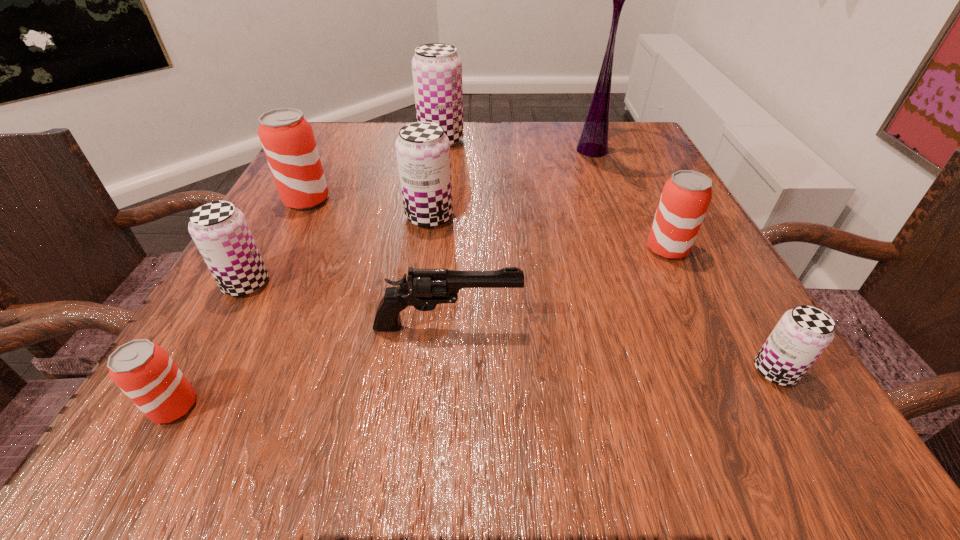
The height and width of the screenshot is (540, 960). In order to click on lampshade in this screenshot , I will do `click(593, 142)`.

Identify the location of the second tallest object. (436, 68).

Locate an element on the screen. The height and width of the screenshot is (540, 960). the farthest beer can is located at coordinates (436, 68).

Find the location of a particular element. the biggest orange beer can is located at coordinates (287, 139).

Find the location of a particular element. The height and width of the screenshot is (540, 960). the second farthest purple beer can is located at coordinates (423, 149).

The height and width of the screenshot is (540, 960). Find the location of `the fourth farthest beer can`. the fourth farthest beer can is located at coordinates (685, 198).

This screenshot has width=960, height=540. What are the coordinates of `the rightmost orange beer can` in the screenshot? It's located at (685, 198).

Image resolution: width=960 pixels, height=540 pixels. Find the location of `the sixth farthest object`. the sixth farthest object is located at coordinates (220, 231).

At what (x,y) coordinates should I click in order to perform the action: click on the third biggest purple beer can. Please return your answer as a coordinate pair (x, y). The width and height of the screenshot is (960, 540). Looking at the image, I should click on (220, 231).

Where is `black gun`? The width and height of the screenshot is (960, 540). black gun is located at coordinates (425, 288).